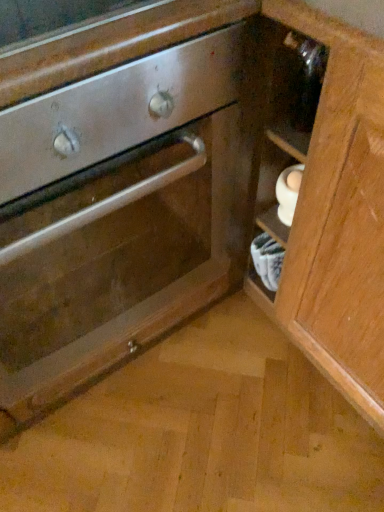
The width and height of the screenshot is (384, 512). Find the location of `stainless steel oven at left`. stainless steel oven at left is located at coordinates (123, 262).

This screenshot has height=512, width=384. Describe the element at coordinates (123, 262) in the screenshot. I see `stainless steel oven at left` at that location.

Measure the distance between stainless steel oven at left and camera.

A distance of 24.06 inches exists between stainless steel oven at left and camera.

Where is `stainless steel oven at left`? The height and width of the screenshot is (512, 384). stainless steel oven at left is located at coordinates (123, 262).